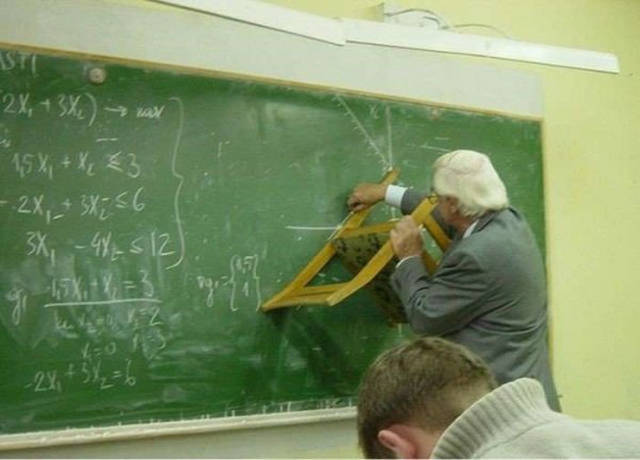
Locate an element on the screen. The width and height of the screenshot is (640, 460). frame is located at coordinates (353, 90).